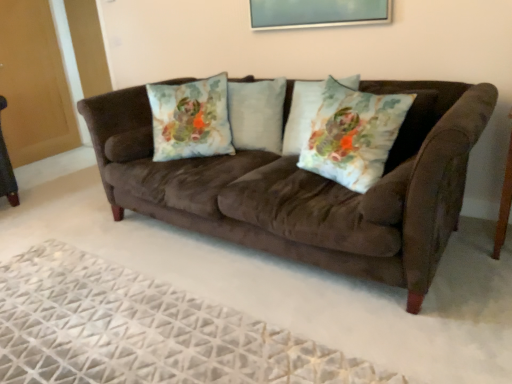
In order to face suede couch at center, should I rotate leftwards or rightwards?

It's best to rotate right around 1.747 degrees.

At what (x,y) coordinates should I click in order to perform the action: click on light blue fabric pillow at center, which is the first pillow in right-to-left order. Please return your answer as a coordinate pair (x, y). Looking at the image, I should click on (301, 115).

Describe the element at coordinates (504, 205) in the screenshot. This screenshot has width=512, height=384. I see `brown wood side table at right` at that location.

Locate an element on the screen. This screenshot has height=384, width=512. fluffy white pillow at center, arranged as the 2th pillow when viewed from the right is located at coordinates (257, 114).

At what (x,y) coordinates should I click in order to perform the action: click on white textured rug at lower center. Please return your answer as a coordinate pair (x, y). Image resolution: width=512 pixels, height=384 pixels. Looking at the image, I should click on (144, 331).

From a real-world perspective, is fluffy white pillow at center, arranged as the 2th pillow when viewed from the right, physically above floral fabric pillow at center, positioned as the 1th throw pillow in front-to-back order?

Yes.

Is fluffy white pillow at center, arranged as the 2th pillow when viewed from the right, located outside floral fabric pillow at center, positioned as the 1th throw pillow in front-to-back order?

Yes, fluffy white pillow at center, arranged as the 2th pillow when viewed from the right, is not within floral fabric pillow at center, positioned as the 1th throw pillow in front-to-back order.

Looking at their sizes, would you say fluffy white pillow at center, which appears as the first pillow when viewed from the left, is wider or thinner than floral fabric pillow at center, which ranks as the second throw pillow in back-to-front order?

In the image, fluffy white pillow at center, which appears as the first pillow when viewed from the left, appears to be wider than floral fabric pillow at center, which ranks as the second throw pillow in back-to-front order.

The height and width of the screenshot is (384, 512). There is a floral fabric pillow at center, which ranks as the second throw pillow in back-to-front order. Identify the location of the 2nd pillow above it (from the image's perspective). (257, 114).

From the image's perspective, is white textured rug at lower center above floral fabric pillow at center, marked as the first throw pillow in a right-to-left arrangement?

No, from the image's perspective, white textured rug at lower center is not above floral fabric pillow at center, marked as the first throw pillow in a right-to-left arrangement.

Considering the sizes of objects white textured rug at lower center and floral fabric pillow at center, positioned as the 1th throw pillow in front-to-back order, in the image provided, who is shorter, white textured rug at lower center or floral fabric pillow at center, positioned as the 1th throw pillow in front-to-back order,?

white textured rug at lower center is shorter.

Considering the sizes of white textured rug at lower center and floral fabric pillow at center, which ranks as the second throw pillow in back-to-front order, in the image, is white textured rug at lower center wider or thinner than floral fabric pillow at center, which ranks as the second throw pillow in back-to-front order,?

In the image, white textured rug at lower center appears to be wider than floral fabric pillow at center, which ranks as the second throw pillow in back-to-front order.

How much distance is there between metallic silver picture frame at upper center and suede couch at center?

They are 3.54 feet apart.

From a real-world perspective, is metallic silver picture frame at upper center physically above suede couch at center?

Correct, in the physical world, metallic silver picture frame at upper center is higher than suede couch at center.

Is metallic silver picture frame at upper center aimed at suede couch at center?

No.

Is the depth of metallic silver picture frame at upper center greater than that of suede couch at center?

Yes, metallic silver picture frame at upper center is behind suede couch at center.

Find the location of a particular element. The image size is (512, 384). studio couch in front of the floral fabric pillow at center, positioned as the 2th throw pillow in right-to-left order is located at coordinates point(307,187).

Considering the positions of objects suede couch at center and floral fabric pillow at center, positioned as the 2th throw pillow in right-to-left order, in the image provided, who is more to the left, suede couch at center or floral fabric pillow at center, positioned as the 2th throw pillow in right-to-left order,?

floral fabric pillow at center, positioned as the 2th throw pillow in right-to-left order, is more to the left.

Is suede couch at center thinner than floral fabric pillow at center, positioned as the second throw pillow in front-to-back order?

No.

Is suede couch at center with floral fabric pillow at center, acting as the first throw pillow starting from the left?

No, suede couch at center is not in contact with floral fabric pillow at center, acting as the first throw pillow starting from the left.

Is white textured rug at lower center at the back of brown wood side table at right?

No, white textured rug at lower center is not at the back of brown wood side table at right.

Is brown wood side table at right directly adjacent to white textured rug at lower center?

They are not placed beside each other.

The height and width of the screenshot is (384, 512). I want to click on plain on the left of brown wood side table at right, so click(x=144, y=331).

From the image's perspective, is brown wood side table at right over white textured rug at lower center?

Correct, brown wood side table at right appears higher than white textured rug at lower center in the image.

Would you consider suede couch at center to be distant from brown wood side table at right?

Indeed, suede couch at center is not near brown wood side table at right.

Does suede couch at center have a greater height compared to brown wood side table at right?

Yes.

Is suede couch at center smaller than brown wood side table at right?

No, suede couch at center is not smaller than brown wood side table at right.

Can you confirm if light blue fabric pillow at center, which is the first pillow in right-to-left order, is positioned to the left of floral fabric pillow at center, which ranks as the second throw pillow in left-to-right order?

Indeed, light blue fabric pillow at center, which is the first pillow in right-to-left order, is positioned on the left side of floral fabric pillow at center, which ranks as the second throw pillow in left-to-right order.

Is light blue fabric pillow at center, positioned as the second pillow in left-to-right order, beside floral fabric pillow at center, which ranks as the second throw pillow in back-to-front order?

A: They are not placed beside each other.

Looking at this image, is light blue fabric pillow at center, which is the first pillow in right-to-left order, positioned in front of floral fabric pillow at center, positioned as the 1th throw pillow in front-to-back order?

No.

I want to click on throw pillow below the fluffy white pillow at center, arranged as the 2th pillow when viewed from the right (from a real-world perspective), so click(x=353, y=135).

The image size is (512, 384). Find the location of `plain in front of the floral fabric pillow at center, positioned as the 1th throw pillow in front-to-back order`. plain in front of the floral fabric pillow at center, positioned as the 1th throw pillow in front-to-back order is located at coordinates (144, 331).

Considering their positions, is light blue fabric pillow at center, which is the first pillow in right-to-left order, positioned closer to brown wood side table at right than floral fabric pillow at center, positioned as the 1th throw pillow in front-to-back order?

Among the two, floral fabric pillow at center, positioned as the 1th throw pillow in front-to-back order, is located nearer to brown wood side table at right.

Considering their positions, is light blue fabric pillow at center, positioned as the second pillow in left-to-right order, positioned further to brown wood side table at right than white textured rug at lower center?

white textured rug at lower center lies further to brown wood side table at right than the other object.

When comparing their distances from light blue fabric pillow at center, positioned as the second pillow in left-to-right order, does brown wood side table at right or metallic silver picture frame at upper center seem further?

Among the two, brown wood side table at right is located further to light blue fabric pillow at center, positioned as the second pillow in left-to-right order.

Based on their spatial positions, is fluffy white pillow at center, which appears as the first pillow when viewed from the left, or white textured rug at lower center further from suede couch at center?

white textured rug at lower center is positioned further to the anchor suede couch at center.

Estimate the real-world distances between objects in this image. Which object is further from floral fabric pillow at center, positioned as the second throw pillow in front-to-back order, suede couch at center or fluffy white pillow at center, which appears as the first pillow when viewed from the left?

suede couch at center lies further to floral fabric pillow at center, positioned as the second throw pillow in front-to-back order, than the other object.

From the image, which object appears to be farther from floral fabric pillow at center, marked as the first throw pillow in a right-to-left arrangement, fluffy white pillow at center, arranged as the 2th pillow when viewed from the right, or suede couch at center?

Based on the image, fluffy white pillow at center, arranged as the 2th pillow when viewed from the right, appears to be further to floral fabric pillow at center, marked as the first throw pillow in a right-to-left arrangement.

From the image, which object appears to be farther from suede couch at center, light blue fabric pillow at center, positioned as the second pillow in left-to-right order, or floral fabric pillow at center, positioned as the 2th throw pillow in right-to-left order?

Based on the image, light blue fabric pillow at center, positioned as the second pillow in left-to-right order, appears to be further to suede couch at center.

From the picture: Based on their spatial positions, is floral fabric pillow at center, marked as the first throw pillow in a right-to-left arrangement, or white textured rug at lower center further from suede couch at center?

white textured rug at lower center lies further to suede couch at center than the other object.

You are a GUI agent. You are given a task and a screenshot of the screen. Output one action in this format:
    pyautogui.click(x=<x>, y=<y>)
    Task: Click on the picture frame positioned between suede couch at center and floral fabric pillow at center, positioned as the second throw pillow in front-to-back order, from near to far
    This screenshot has width=512, height=384.
    Given the screenshot: What is the action you would take?
    pyautogui.click(x=317, y=13)

What are the coordinates of `picture frame between fluffy white pillow at center, which appears as the first pillow when viewed from the left, and brown wood side table at right, in the horizontal direction` in the screenshot? It's located at (317, 13).

In order to click on pillow between floral fabric pillow at center, acting as the first throw pillow starting from the left, and light blue fabric pillow at center, positioned as the second pillow in left-to-right order in this screenshot , I will do tap(257, 114).

Locate an element on the screen. studio couch between white textured rug at lower center and brown wood side table at right from left to right is located at coordinates (307, 187).